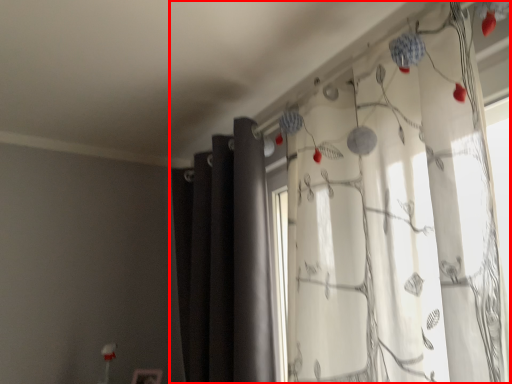
Question: From the image's perspective, what is the correct spatial relationship of curtain (annotated by the red box) in relation to curtain?

Choices:
 (A) above
 (B) below

Answer: (A)